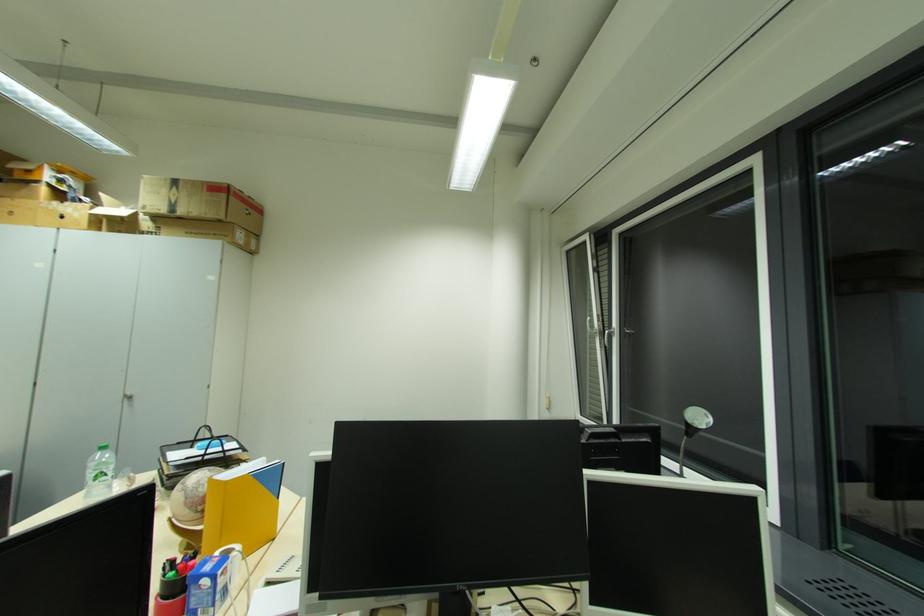
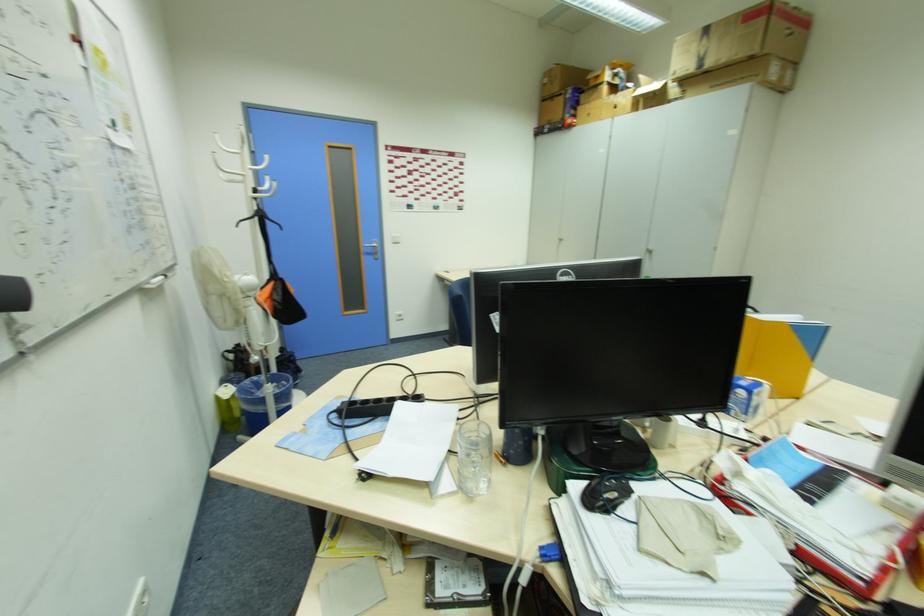
Question: I am providing you with two images of the same scene from different viewpoints. Please identify which objects are invisible in image2.

Choices:
 (A) black trash bin
 (B) green plastic bottle
 (C) letter tray handle
 (D) yellow binder

Answer: (C)